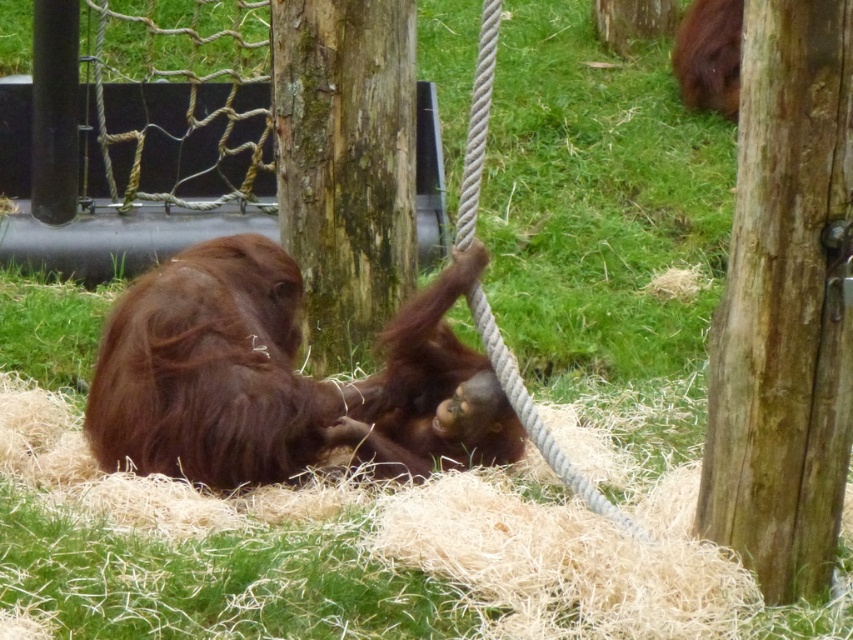
Question: Is smooth brown wood at right to the left of brown furry orangutan at upper right from the viewer's perspective?

Choices:
 (A) yes
 (B) no

Answer: (A)

Question: Does smooth brown wood at right have a larger size compared to brown furry orangutan at lower left?

Choices:
 (A) yes
 (B) no

Answer: (B)

Question: Which point is farther to the camera?

Choices:
 (A) click(283, 189)
 (B) click(155, 285)

Answer: (A)

Question: Can you confirm if smooth brown wood at right is positioned below brown furry orangutan at lower left?

Choices:
 (A) no
 (B) yes

Answer: (A)

Question: Estimate the real-world distances between objects in this image. Which object is closer to the brown furry orangutan at lower left?

Choices:
 (A) smooth brown wood at right
 (B) brown rough wood at center
 (C) brown furry orangutan at upper right
 (D) brown furry orangutan at center

Answer: (D)

Question: Which object appears farthest from the camera in this image?

Choices:
 (A) smooth brown wood at right
 (B) brown rough wood at center

Answer: (B)